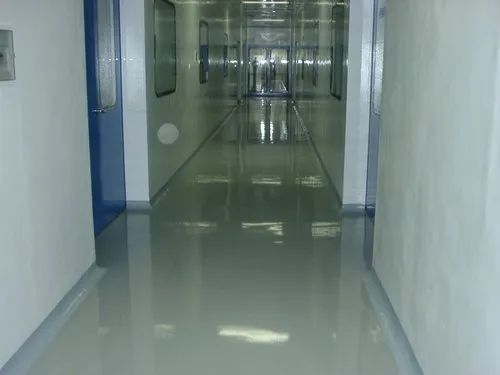
Identify the location of wall hanging or windows. The width and height of the screenshot is (500, 375). (163, 60), (202, 48), (225, 59), (336, 70), (316, 48), (303, 47).